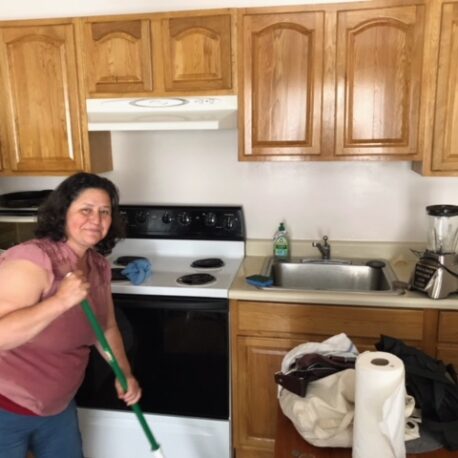
Locate an element on the screen. This screenshot has height=458, width=458. range hood is located at coordinates (193, 119).